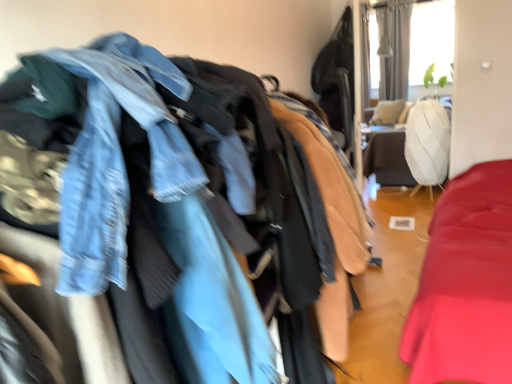
Question: In the image, is faded denim jacket at upper left positioned in front of or behind white textured curtain at upper right?

Choices:
 (A) front
 (B) behind

Answer: (A)

Question: Is faded denim jacket at upper left bigger or smaller than white textured curtain at upper right?

Choices:
 (A) big
 (B) small

Answer: (A)

Question: Is faded denim jacket at upper left situated inside white textured curtain at upper right or outside?

Choices:
 (A) outside
 (B) inside

Answer: (A)

Question: Considering the positions of white textured curtain at upper right and faded denim jacket at upper left in the image, is white textured curtain at upper right taller or shorter than faded denim jacket at upper left?

Choices:
 (A) short
 (B) tall

Answer: (B)

Question: Based on their positions, is white textured curtain at upper right located to the left or right of faded denim jacket at upper left?

Choices:
 (A) right
 (B) left

Answer: (A)

Question: From the image's perspective, is white textured curtain at upper right above or below faded denim jacket at upper left?

Choices:
 (A) below
 (B) above

Answer: (B)

Question: In the image, is white textured curtain at upper right positioned in front of or behind faded denim jacket at upper left?

Choices:
 (A) behind
 (B) front

Answer: (A)